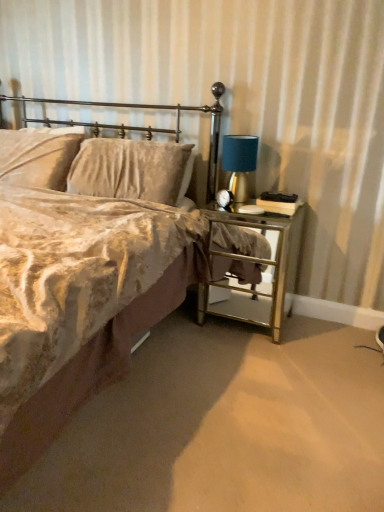
This screenshot has height=512, width=384. Identify the location of vacant space to the left of gold mirrored nightstand at right. (182, 334).